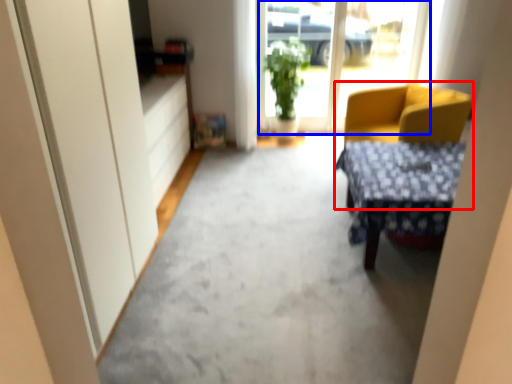
Question: Which object appears closest to the camera in this image, chair (highlighted by a red box) or window screen (highlighted by a blue box)?

Choices:
 (A) chair
 (B) window screen

Answer: (A)